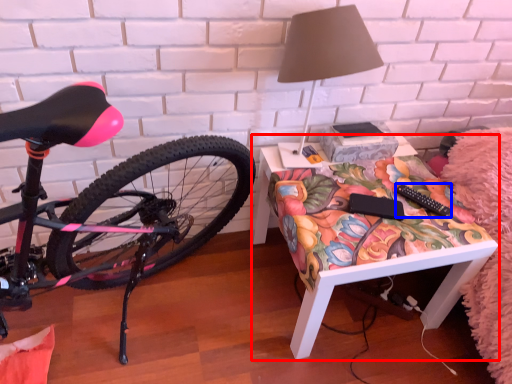
Question: Which object is further to the camera taking this photo, desk (highlighted by a red box) or remote control (highlighted by a blue box)?

Choices:
 (A) desk
 (B) remote control

Answer: (B)